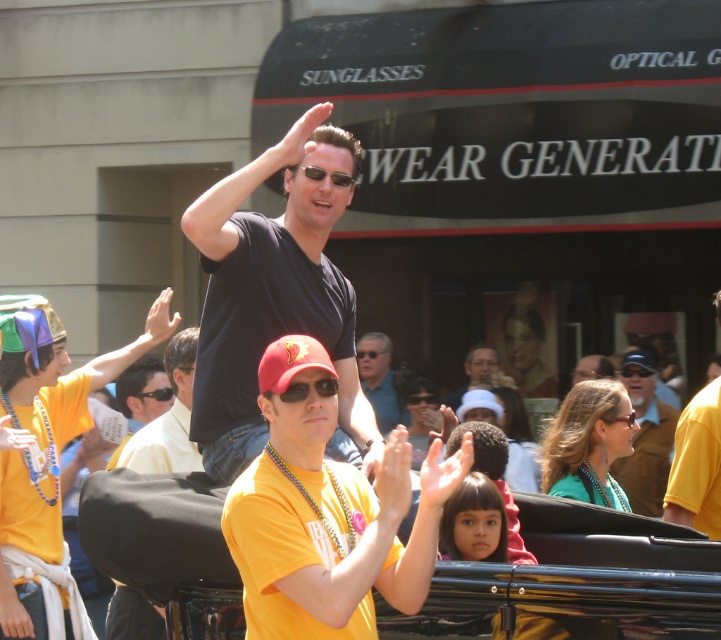
Consider the image. Is shiny black convertible at center to the left of black matte t-shirt at upper center from the viewer's perspective?

Incorrect, shiny black convertible at center is not on the left side of black matte t-shirt at upper center.

Is shiny black convertible at center further to camera compared to black matte t-shirt at upper center?

No, it is in front of black matte t-shirt at upper center.

Between point (707, 595) and point (224, 275), which one is positioned behind?

Positioned behind is point (224, 275).

You are a GUI agent. You are given a task and a screenshot of the screen. Output one action in this format:
    pyautogui.click(x=<x>, y=<y>)
    Task: Click on the shiny black convertible at center
    This screenshot has height=640, width=721.
    Given the screenshot: What is the action you would take?
    pyautogui.click(x=580, y=577)

Is yellow fabric shirt at center above yellow t-shirt at center?

No.

Between yellow fabric shirt at center and yellow t-shirt at center, which one has more height?

Standing taller between the two is yellow fabric shirt at center.

Where is `yellow fabric shirt at center`? The height and width of the screenshot is (640, 721). yellow fabric shirt at center is located at coordinates (167, 419).

I want to click on yellow fabric shirt at center, so click(x=167, y=419).

Does yellow t-shirt at center have a lesser height compared to matte brown jacket at center?

Correct, yellow t-shirt at center is not as tall as matte brown jacket at center.

Does point (689, 472) lie behind point (650, 420)?

No, (689, 472) is closer to viewer.

Does point (685, 490) come behind point (658, 508)?

No, (685, 490) is in front of (658, 508).

In order to click on yellow t-shirt at center in this screenshot , I will do `click(696, 465)`.